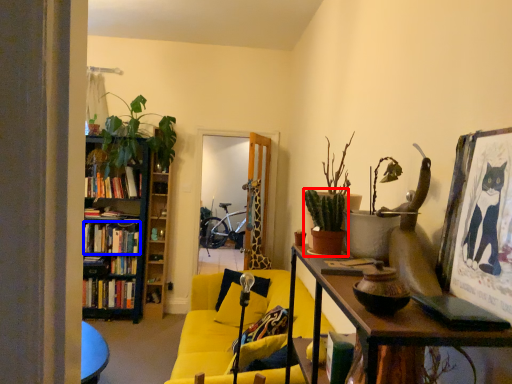
Question: Which object is further to the camera taking this photo, houseplant (highlighted by a red box) or book (highlighted by a blue box)?

Choices:
 (A) houseplant
 (B) book

Answer: (B)